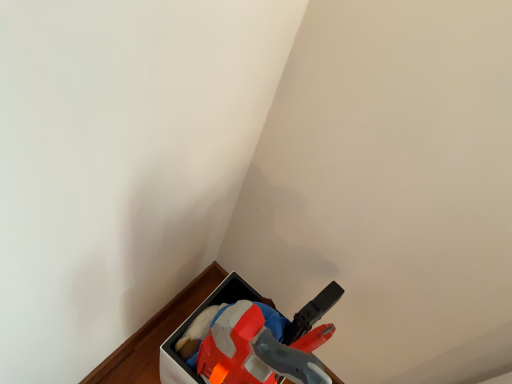
I want to click on plastic toy robot at lower center, so click(x=155, y=323).

What do you see at coordinates (155, 323) in the screenshot? This screenshot has height=384, width=512. I see `plastic toy robot at lower center` at bounding box center [155, 323].

Find the location of a particular element. plastic toy robot at lower center is located at coordinates (155, 323).